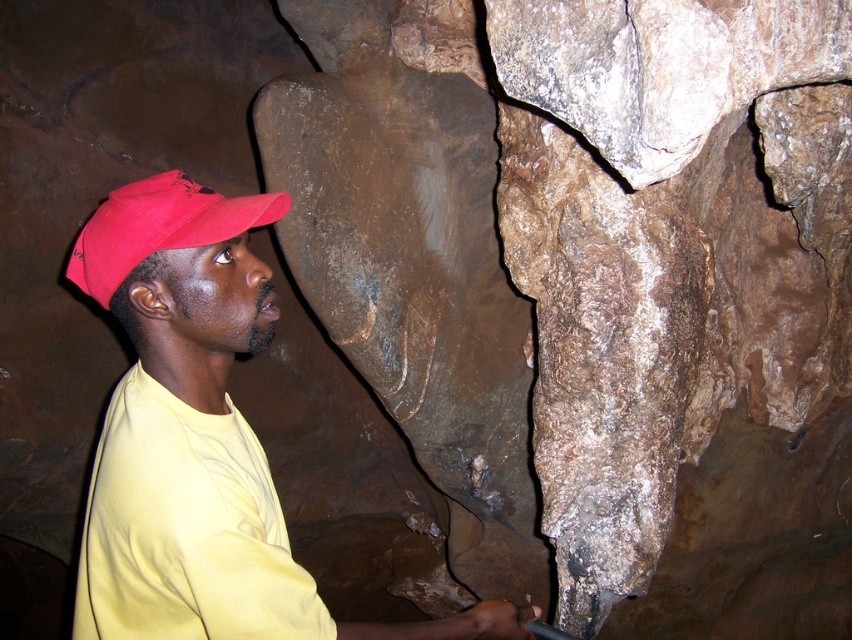
You are a geologist in the cave and need to collect a sample from the brown rough rock at center. You are currently standing next to the yellow matte shirt at center. Can you reach the rock without moving your feet?

The brown rough rock at center and yellow matte shirt at center are 3.37 feet apart from each other. Since the distance is greater than an average person can reach, you cannot reach the rock without moving your feet.

You are a photographer standing in the cave and want to take a closeup shot of the brown rough rock at center. Your camera has a minimum focusing distance of 6 feet. Can you take the photo without moving closer?

The brown rough rock at center is 5.59 feet away from the camera, which is within the camera minimum focusing distance of 6 feet. Therefore, you can take the closeup shot without moving closer.

In the scene shown: You are an explorer in a cave wearing a yellow matte shirt at center. You notice a brown rough rock at center nearby. If you want to place your shirt on top of the rock, will it fit entirely?

The brown rough rock at center is bigger than the yellow matte shirt at center, so the shirt will fit entirely on top of the rock.